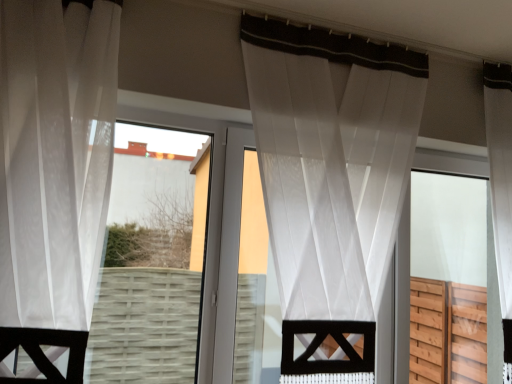
The image size is (512, 384). What do you see at coordinates (448, 278) in the screenshot?
I see `transparent wood screen door at right` at bounding box center [448, 278].

I want to click on transparent fabric at center, so click(x=151, y=259).

Image resolution: width=512 pixels, height=384 pixels. Identify the location of transparent wood screen door at right. (448, 278).

Which is farther from the camera, [129,345] or [36,154]?

The point [129,345] is behind.

Does transparent fabric at center contain white sheer curtain at left, the first curtain when ordered from left to right?

No.

Which is more to the left, transparent fabric at center or white sheer curtain at left, the 1th curtain from the front?

white sheer curtain at left, the 1th curtain from the front.

Considering the relative sizes of transparent fabric at center and white sheer curtain at left, placed as the 2th curtain when sorted from back to front, in the image provided, is transparent fabric at center bigger than white sheer curtain at left, placed as the 2th curtain when sorted from back to front,?

Incorrect, transparent fabric at center is not larger than white sheer curtain at left, placed as the 2th curtain when sorted from back to front.

Considering the relative sizes of sheer white curtain at center, positioned as the 2th curtain in front-to-back order, and transparent wood screen door at right in the image provided, is sheer white curtain at center, positioned as the 2th curtain in front-to-back order, bigger than transparent wood screen door at right?

Yes, sheer white curtain at center, positioned as the 2th curtain in front-to-back order, is bigger than transparent wood screen door at right.

Is transparent wood screen door at right surrounded by sheer white curtain at center, which is counted as the 1th curtain, starting from the back?

No, transparent wood screen door at right is not a part of sheer white curtain at center, which is counted as the 1th curtain, starting from the back.

Who is shorter, sheer white curtain at center, positioned as the 2th curtain in front-to-back order, or transparent wood screen door at right?

transparent wood screen door at right is shorter.

Considering the relative positions of sheer white curtain at center, the 2th curtain in the left-to-right sequence, and transparent wood screen door at right in the image provided, is sheer white curtain at center, the 2th curtain in the left-to-right sequence, in front of transparent wood screen door at right?

Yes, sheer white curtain at center, the 2th curtain in the left-to-right sequence, is closer to the viewer.

Is white sheer curtain at left, placed as the 2th curtain when sorted from back to front, positioned far away from sheer white curtain at center, which is counted as the 1th curtain, starting from the back?

No, white sheer curtain at left, placed as the 2th curtain when sorted from back to front, is not far from sheer white curtain at center, which is counted as the 1th curtain, starting from the back.

Consider the image. Would you say white sheer curtain at left, the first curtain when ordered from left to right, contains sheer white curtain at center, the 2th curtain in the left-to-right sequence?

No, sheer white curtain at center, the 2th curtain in the left-to-right sequence, is not surrounded by white sheer curtain at left, the first curtain when ordered from left to right.

Is point (14, 299) closer to viewer compared to point (339, 264)?

Yes, point (14, 299) is in front of point (339, 264).

Considering the positions of objects white sheer curtain at left, marked as the 2th curtain in a right-to-left arrangement, and sheer white curtain at center, the 2th curtain in the left-to-right sequence, in the image provided, who is more to the right, white sheer curtain at left, marked as the 2th curtain in a right-to-left arrangement, or sheer white curtain at center, the 2th curtain in the left-to-right sequence,?

sheer white curtain at center, the 2th curtain in the left-to-right sequence, is more to the right.

Can you see transparent wood screen door at right touching transparent fabric at center?

No, transparent wood screen door at right is not making contact with transparent fabric at center.

Is point (466, 289) more distant than point (191, 181)?

No, (466, 289) is closer to viewer.

From a real-world perspective, who is located lower, transparent wood screen door at right or transparent fabric at center?

transparent wood screen door at right, from a real-world perspective.

Which is behind, point (46, 52) or point (185, 356)?

The point (185, 356) is behind.

From the image's perspective, which one is positioned higher, white sheer curtain at left, the first curtain when ordered from left to right, or transparent fabric at center?

From the image's view, white sheer curtain at left, the first curtain when ordered from left to right, is above.

Looking at the image, does white sheer curtain at left, the 1th curtain from the front, seem bigger or smaller compared to transparent fabric at center?

Clearly, white sheer curtain at left, the 1th curtain from the front, is larger in size than transparent fabric at center.

Is the surface of white sheer curtain at left, marked as the 2th curtain in a right-to-left arrangement, in direct contact with transparent fabric at center?

No, white sheer curtain at left, marked as the 2th curtain in a right-to-left arrangement, is not in contact with transparent fabric at center.

The image size is (512, 384). What are the coordinates of `curtain to the right of white sheer curtain at left, the 1th curtain from the front` in the screenshot? It's located at (331, 182).

Which object is closer to the camera taking this photo, sheer white curtain at center, positioned as the 1th curtain in right-to-left order, or white sheer curtain at left, placed as the 2th curtain when sorted from back to front?

white sheer curtain at left, placed as the 2th curtain when sorted from back to front.

From the image's perspective, is sheer white curtain at center, which is counted as the 1th curtain, starting from the back, positioned above or below white sheer curtain at left, the first curtain when ordered from left to right?

Clearly, from the image's perspective, sheer white curtain at center, which is counted as the 1th curtain, starting from the back, is below white sheer curtain at left, the first curtain when ordered from left to right.

In the scene shown: From a real-world perspective, between sheer white curtain at center, positioned as the 1th curtain in right-to-left order, and white sheer curtain at left, placed as the 2th curtain when sorted from back to front, who is vertically higher?

In real-world perspective, white sheer curtain at left, placed as the 2th curtain when sorted from back to front, is above.

Are transparent fabric at center and transparent wood screen door at right far apart?

transparent fabric at center is positioned a significant distance from transparent wood screen door at right.

Looking at the image, does transparent fabric at center seem bigger or smaller compared to transparent wood screen door at right?

In the image, transparent fabric at center appears to be smaller than transparent wood screen door at right.

Which is in front, point (177, 231) or point (420, 262)?

The point (420, 262) is in front.

Does transparent fabric at center appear on the right side of transparent wood screen door at right?

Incorrect, transparent fabric at center is not on the right side of transparent wood screen door at right.

I want to click on bay window on the right of the white sheer curtain at left, the 1th curtain from the front, so click(x=151, y=259).

Locate an element on the screen. This screenshot has height=384, width=512. screen door below the sheer white curtain at center, the 2th curtain in the left-to-right sequence (from a real-world perspective) is located at coordinates (448, 278).

When comparing their distances from transparent fabric at center, does white sheer curtain at left, marked as the 2th curtain in a right-to-left arrangement, or transparent wood screen door at right seem further?

transparent wood screen door at right is further to transparent fabric at center.

Based on their spatial positions, is transparent fabric at center or sheer white curtain at center, which is counted as the 1th curtain, starting from the back, further from white sheer curtain at left, marked as the 2th curtain in a right-to-left arrangement?

transparent fabric at center is positioned further to the anchor white sheer curtain at left, marked as the 2th curtain in a right-to-left arrangement.

Which object lies further to the anchor point transparent fabric at center, sheer white curtain at center, positioned as the 2th curtain in front-to-back order, or white sheer curtain at left, placed as the 2th curtain when sorted from back to front?

white sheer curtain at left, placed as the 2th curtain when sorted from back to front, is further to transparent fabric at center.

In the scene shown: Which object lies further to the anchor point white sheer curtain at left, marked as the 2th curtain in a right-to-left arrangement, transparent fabric at center or transparent wood screen door at right?

The object further to white sheer curtain at left, marked as the 2th curtain in a right-to-left arrangement, is transparent wood screen door at right.

When comparing their distances from sheer white curtain at center, positioned as the 2th curtain in front-to-back order, does white sheer curtain at left, placed as the 2th curtain when sorted from back to front, or transparent wood screen door at right seem further?

transparent wood screen door at right is positioned further to the anchor sheer white curtain at center, positioned as the 2th curtain in front-to-back order.

Looking at the image, which one is located further to transparent wood screen door at right, sheer white curtain at center, the 2th curtain in the left-to-right sequence, or white sheer curtain at left, marked as the 2th curtain in a right-to-left arrangement?

The object further to transparent wood screen door at right is white sheer curtain at left, marked as the 2th curtain in a right-to-left arrangement.

From the image, which object appears to be nearer to white sheer curtain at left, marked as the 2th curtain in a right-to-left arrangement, sheer white curtain at center, positioned as the 1th curtain in right-to-left order, or transparent wood screen door at right?

sheer white curtain at center, positioned as the 1th curtain in right-to-left order, lies closer to white sheer curtain at left, marked as the 2th curtain in a right-to-left arrangement, than the other object.

Looking at the image, which one is located closer to transparent wood screen door at right, transparent fabric at center or white sheer curtain at left, marked as the 2th curtain in a right-to-left arrangement?

transparent fabric at center lies closer to transparent wood screen door at right than the other object.

You are a GUI agent. You are given a task and a screenshot of the screen. Output one action in this format:
    pyautogui.click(x=<x>, y=<y>)
    Task: Click on the bay window between white sheer curtain at left, placed as the 2th curtain when sorted from back to front, and transparent wood screen door at right, in the horizontal direction
    Image resolution: width=512 pixels, height=384 pixels.
    Given the screenshot: What is the action you would take?
    pyautogui.click(x=151, y=259)

This screenshot has height=384, width=512. I want to click on curtain situated between transparent fabric at center and transparent wood screen door at right from left to right, so click(331, 182).

Locate an element on the screen. This screenshot has height=384, width=512. bay window situated between white sheer curtain at left, placed as the 2th curtain when sorted from back to front, and sheer white curtain at center, positioned as the 1th curtain in right-to-left order, from left to right is located at coordinates (151, 259).

At what (x,y) coordinates should I click in order to perform the action: click on curtain between white sheer curtain at left, marked as the 2th curtain in a right-to-left arrangement, and transparent wood screen door at right. Please return your answer as a coordinate pair (x, y). This screenshot has height=384, width=512. Looking at the image, I should click on (331, 182).